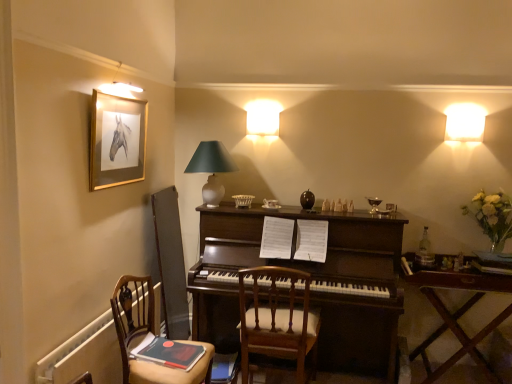
Question: Does gold-framed picture at upper left appear on the left side of wooden table at right?

Choices:
 (A) yes
 (B) no

Answer: (A)

Question: Is gold-framed picture at upper left oriented towards wooden table at right?

Choices:
 (A) no
 (B) yes

Answer: (A)

Question: Is wooden table at right completely or partially inside gold-framed picture at upper left?

Choices:
 (A) yes
 (B) no

Answer: (B)

Question: Does gold-framed picture at upper left lie behind wooden table at right?

Choices:
 (A) no
 (B) yes

Answer: (A)

Question: From a real-world perspective, is gold-framed picture at upper left located higher than wooden table at right?

Choices:
 (A) yes
 (B) no

Answer: (A)

Question: From the image's perspective, is gold-framed picture at upper left on top of wooden table at right?

Choices:
 (A) no
 (B) yes

Answer: (B)

Question: From the image's perspective, is wooden chair at lower left, the first chair viewed from the left, on top of wooden table at right?

Choices:
 (A) yes
 (B) no

Answer: (A)

Question: Is wooden chair at lower left, the first chair viewed from the left, oriented away from wooden table at right?

Choices:
 (A) no
 (B) yes

Answer: (A)

Question: Is the position of wooden chair at lower left, acting as the 2th chair starting from the right, less distant than that of wooden table at right?

Choices:
 (A) yes
 (B) no

Answer: (A)

Question: Is wooden chair at lower left, the first chair viewed from the left, next to wooden table at right and touching it?

Choices:
 (A) no
 (B) yes

Answer: (A)

Question: Is wooden chair at lower left, acting as the 2th chair starting from the right, not near wooden table at right?

Choices:
 (A) yes
 (B) no

Answer: (A)

Question: Does wooden chair at lower left, acting as the 2th chair starting from the right, appear on the left side of wooden table at right?

Choices:
 (A) yes
 (B) no

Answer: (A)

Question: Would you say matte white lampshade at center is part of wooden chair at lower left, acting as the 2th chair starting from the right,'s contents?

Choices:
 (A) yes
 (B) no

Answer: (B)